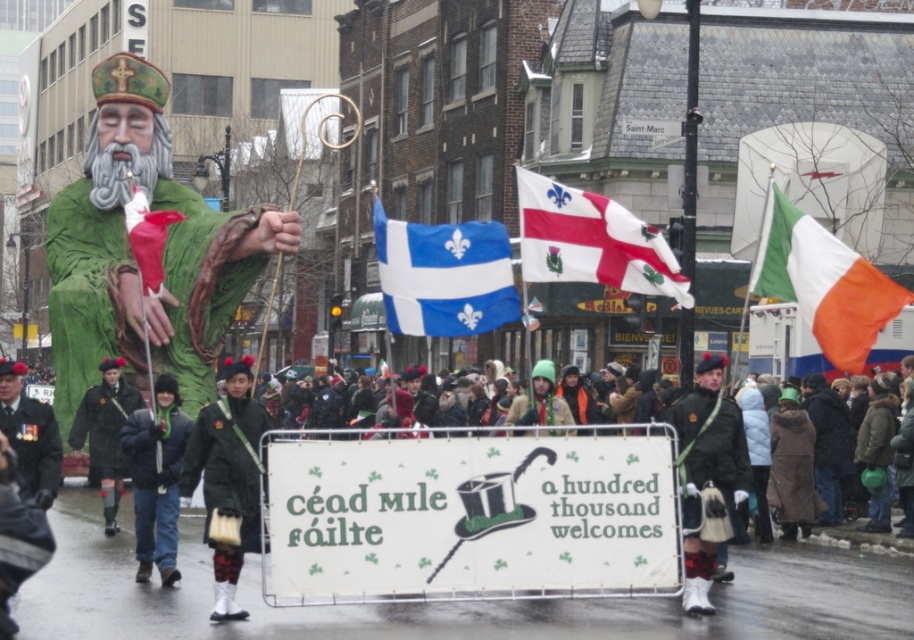
Question: Which object appears closest to the camera in this image?

Choices:
 (A) dark green uniform at center
 (B) dark green fabric uniform at center

Answer: (A)

Question: From the image, what is the correct spatial relationship of dark blue jacket at center in relation to brown quilted coat at lower right?

Choices:
 (A) above
 (B) below

Answer: (A)

Question: Can you confirm if white fabric flag at upper right is positioned to the right of dark green uniform at center?

Choices:
 (A) no
 (B) yes

Answer: (B)

Question: Which point is closer to the camera?

Choices:
 (A) (805, 419)
 (B) (636, 228)

Answer: (B)

Question: Which point is farther to the camera?

Choices:
 (A) (521, 211)
 (B) (811, 436)
 (C) (25, 403)
 (D) (386, 241)

Answer: (B)

Question: Is whitematerialflag at center bigger than dark blue jacket at center?

Choices:
 (A) no
 (B) yes

Answer: (B)